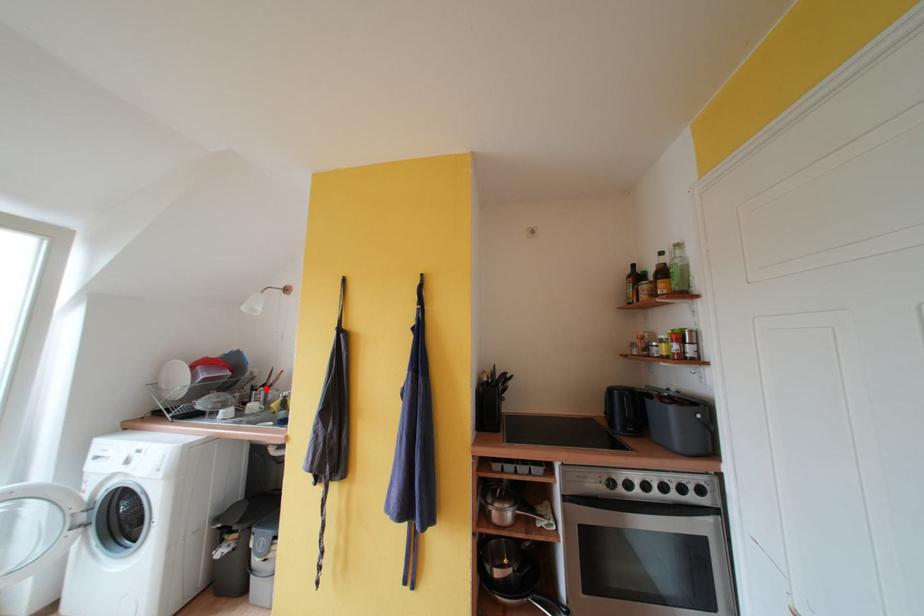
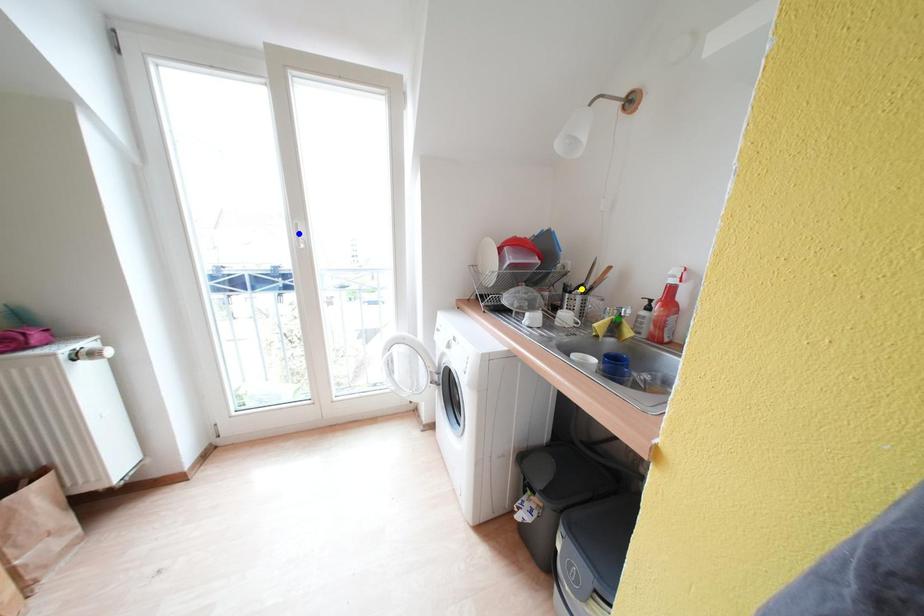
Question: I am providing you with two images of the same scene from different viewpoints. A red point is marked on the first image. You are given multiple points on the second image. Which point in image 2 is actually the same real-world point as the red point in image 1?

Choices:
 (A) green point
 (B) yellow point
 (C) blue point

Answer: (B)